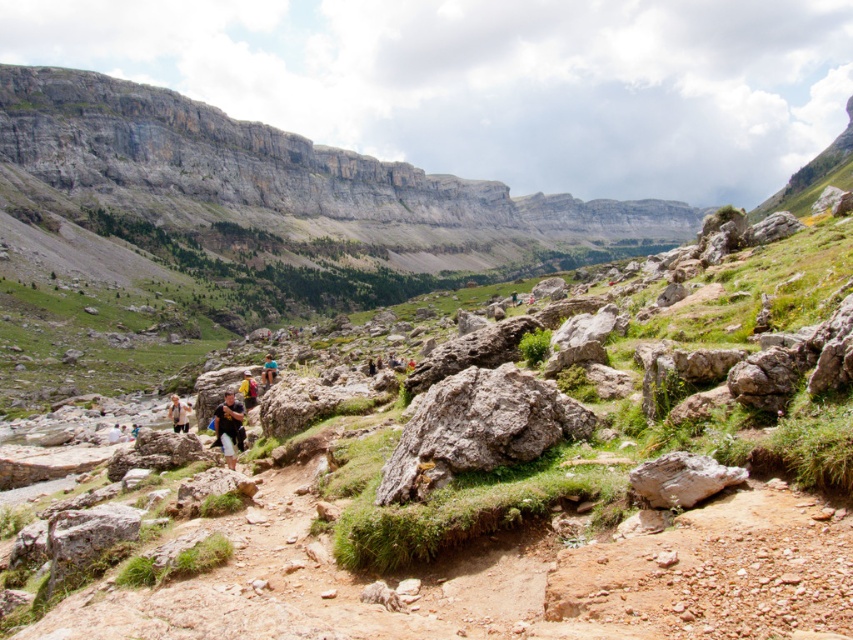
Measure the distance from gray rough rock at lower right to yellow fabric backpack at center.

140.42 feet

Does gray rough rock at lower right have a greater width compared to yellow fabric backpack at center?

Correct, the width of gray rough rock at lower right exceeds that of yellow fabric backpack at center.

Consider the image. Measure the distance between point (689, 500) and camera.

Point (689, 500) is 31.13 meters away from camera.

In order to click on gray rough rock at lower right in this screenshot , I will do `click(682, 477)`.

Does gray rough rock at lower right appear over white cotton shirt at center?

Yes, gray rough rock at lower right is above white cotton shirt at center.

The width and height of the screenshot is (853, 640). I want to click on gray rough rock at lower right, so click(682, 477).

Who is more forward, (712, 476) or (119, 436)?

Positioned in front is point (712, 476).

You are a GUI agent. You are given a task and a screenshot of the screen. Output one action in this format:
    pyautogui.click(x=<x>, y=<y>)
    Task: Click on the gray rough rock at lower right
    The image size is (853, 640).
    Given the screenshot: What is the action you would take?
    (x=682, y=477)

Is matte black shorts at lower left bigger than blue fabric backpack at center?

Correct, matte black shorts at lower left is larger in size than blue fabric backpack at center.

Between point (184, 417) and point (274, 371), which one is positioned in front?

Point (184, 417) is in front.

Does point (178, 404) come behind point (270, 381)?

No.

Find the location of a particular element. This screenshot has width=853, height=640. matte black shorts at lower left is located at coordinates (178, 413).